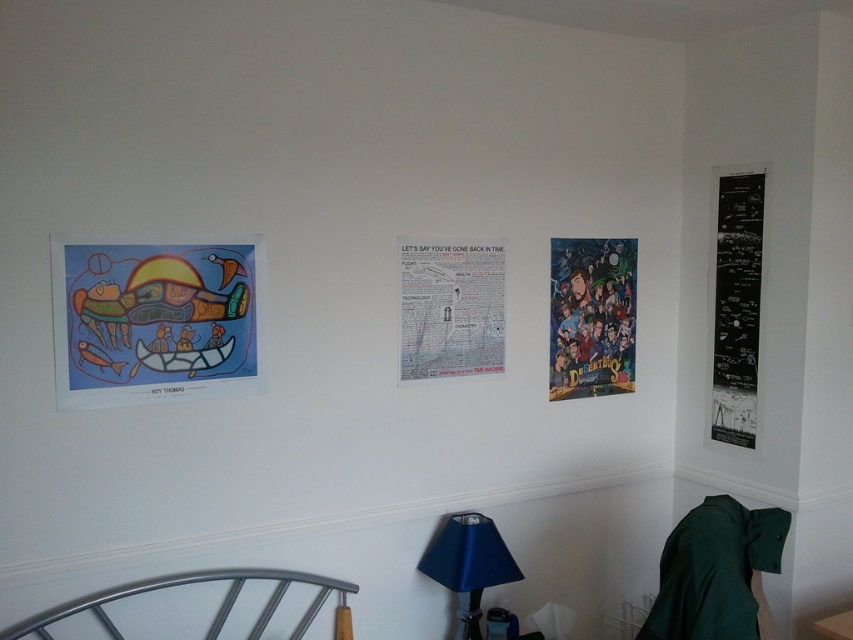
Who is higher up, matte paper poster at upper left or white paper poster at center?

white paper poster at center is higher up.

The image size is (853, 640). I want to click on matte paper poster at upper left, so click(x=155, y=317).

Based on the photo, does white paper poster at center have a lesser width compared to silver metallic bed at lower left?

Indeed, white paper poster at center has a lesser width compared to silver metallic bed at lower left.

Who is taller, white paper poster at center or silver metallic bed at lower left?

Standing taller between the two is white paper poster at center.

The height and width of the screenshot is (640, 853). What do you see at coordinates (450, 307) in the screenshot?
I see `white paper poster at center` at bounding box center [450, 307].

What are the coordinates of `white paper poster at center` in the screenshot? It's located at (450, 307).

Measure the distance from silver metallic bed at lower left to blue fabric lampshade at lower center.

silver metallic bed at lower left is 44.70 centimeters away from blue fabric lampshade at lower center.

Is silver metallic bed at lower left smaller than blue fabric lampshade at lower center?

Incorrect, silver metallic bed at lower left is not smaller in size than blue fabric lampshade at lower center.

The image size is (853, 640). I want to click on silver metallic bed at lower left, so click(196, 582).

You are a GUI agent. You are given a task and a screenshot of the screen. Output one action in this format:
    pyautogui.click(x=<x>, y=<y>)
    Task: Click on the silver metallic bed at lower left
    
    Given the screenshot: What is the action you would take?
    pyautogui.click(x=196, y=582)